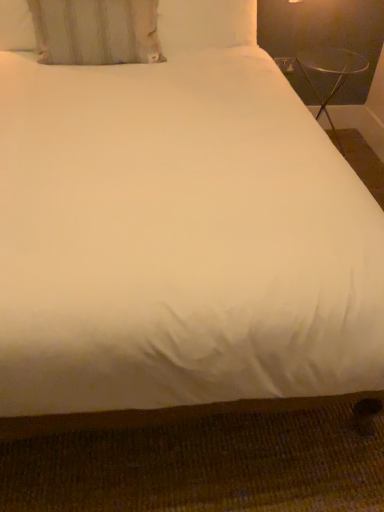
Question: In the image, is transparent glass table at upper right positioned in front of or behind white fabric pillow at upper left?

Choices:
 (A) behind
 (B) front

Answer: (A)

Question: From their relative heights in the image, would you say transparent glass table at upper right is taller or shorter than white fabric pillow at upper left?

Choices:
 (A) short
 (B) tall

Answer: (B)

Question: Is transparent glass table at upper right spatially inside white fabric pillow at upper left, or outside of it?

Choices:
 (A) outside
 (B) inside

Answer: (A)

Question: Looking at the image, does white fabric pillow at upper left seem bigger or smaller compared to transparent glass table at upper right?

Choices:
 (A) small
 (B) big

Answer: (A)

Question: Is white fabric pillow at upper left to the left or to the right of transparent glass table at upper right in the image?

Choices:
 (A) right
 (B) left

Answer: (B)

Question: Relative to transparent glass table at upper right, is white fabric pillow at upper left in front or behind?

Choices:
 (A) behind
 (B) front

Answer: (B)

Question: Looking at their shapes, would you say white fabric pillow at upper left is wider or thinner than transparent glass table at upper right?

Choices:
 (A) thin
 (B) wide

Answer: (A)